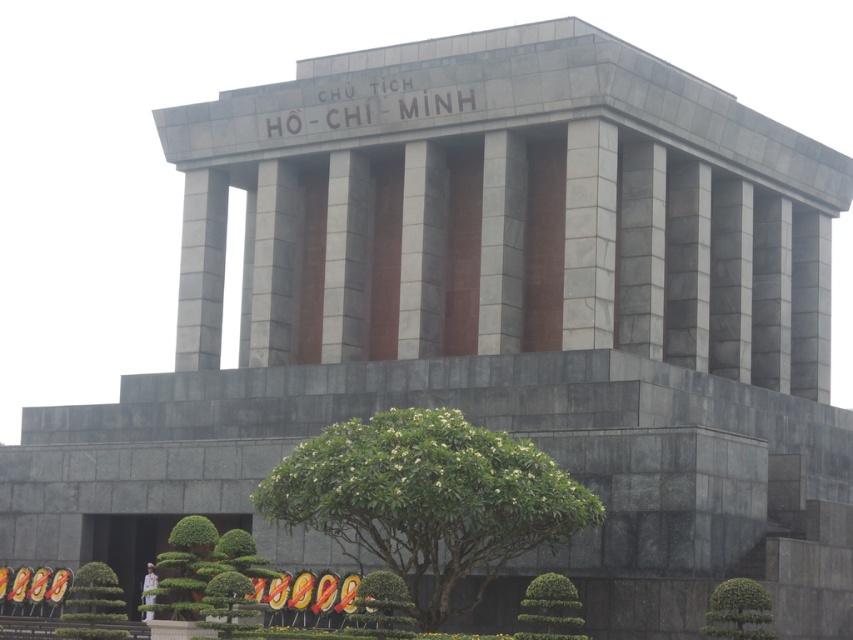
Between point (747, 602) and point (560, 605), which one is positioned behind?

The point (560, 605) is behind.

I want to click on green leafy hedge at lower right, so click(738, 611).

Between green leafy tree at center and green leafy hedge at lower center, which one has less height?

green leafy hedge at lower center

Does green leafy tree at center have a greater height compared to green leafy hedge at lower center?

Yes.

Which is behind, point (402, 410) or point (567, 586)?

Point (402, 410)

The image size is (853, 640). I want to click on green leafy tree at center, so click(x=427, y=500).

How far apart are green leafy tree at center and green leafy hedge at lower right?

They are 6.79 meters apart.

Who is positioned more to the right, green leafy tree at center or green leafy hedge at lower right?

From the viewer's perspective, green leafy hedge at lower right appears more on the right side.

What do you see at coordinates (427, 500) in the screenshot? I see `green leafy tree at center` at bounding box center [427, 500].

What are the coordinates of `green leafy tree at center` in the screenshot? It's located at (427, 500).